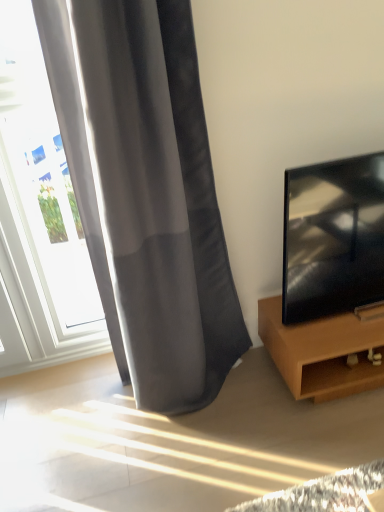
Where is `black glossy tv at right`? This screenshot has height=512, width=384. black glossy tv at right is located at coordinates (333, 238).

From the picture: Measure the distance between black glossy tv at right and camera.

1.43 meters.

What do you see at coordinates (322, 352) in the screenshot?
I see `brown wood tv stand at right` at bounding box center [322, 352].

Identify the location of white glass window at left. The height and width of the screenshot is (512, 384). (42, 188).

Who is more distant, brown wood tv stand at right or black glossy tv at right?

brown wood tv stand at right is behind.

Based on the photo, would you say brown wood tv stand at right is outside black glossy tv at right?

brown wood tv stand at right is positioned outside black glossy tv at right.

From the image's perspective, between brown wood tv stand at right and black glossy tv at right, which one is located above?

black glossy tv at right.

Is brown wood tv stand at right shorter than black glossy tv at right?

Indeed, brown wood tv stand at right has a lesser height compared to black glossy tv at right.

Which is farther, [178,220] or [50,253]?

The point [50,253] is farther.

What's the angular difference between satin gray curtain at left and white glass window at left's facing directions?

They differ by 0.0061 degrees in their facing directions.

Considering the relative sizes of satin gray curtain at left and white glass window at left in the image provided, is satin gray curtain at left shorter than white glass window at left?

In fact, satin gray curtain at left may be taller than white glass window at left.

In the scene shown: Are satin gray curtain at left and white glass window at left making contact?

No, satin gray curtain at left is not making contact with white glass window at left.

What's the angular difference between white glass window at left and brown wood tv stand at right's facing directions?

0.00624 degrees separate the facing orientations of white glass window at left and brown wood tv stand at right.

Is white glass window at left facing away from brown wood tv stand at right?

white glass window at left does not have its back to brown wood tv stand at right.

Can you confirm if white glass window at left is shorter than brown wood tv stand at right?

In fact, white glass window at left may be taller than brown wood tv stand at right.

From a real-world perspective, between white glass window at left and brown wood tv stand at right, who is vertically lower?

From a 3D spatial view, brown wood tv stand at right is below.

Is white glass window at left bigger or smaller than black glossy tv at right?

Considering their sizes, white glass window at left takes up less space than black glossy tv at right.

Does point (62, 302) come closer to viewer compared to point (295, 305)?

No.

Consider the image. Is the surface of white glass window at left in direct contact with black glossy tv at right?

They are not placed beside each other.

From the image's perspective, which object appears higher, white glass window at left or black glossy tv at right?

white glass window at left appears higher in the image.

Is brown wood tv stand at right further to camera compared to satin gray curtain at left?

Yes, brown wood tv stand at right is further from the camera.

Is satin gray curtain at left inside brown wood tv stand at right?

No, satin gray curtain at left is located outside of brown wood tv stand at right.

Which point is more distant from viewer, (270, 315) or (170, 305)?

The point (270, 315) is farther.

Looking at this image, is the position of white glass window at left more distant than that of satin gray curtain at left?

Yes, it is.

How distant is white glass window at left from satin gray curtain at left?

A distance of 17.96 inches exists between white glass window at left and satin gray curtain at left.

From a real-world perspective, is white glass window at left positioned above or below satin gray curtain at left?

white glass window at left is situated lower than satin gray curtain at left in the real world.

Would you say black glossy tv at right is a long distance from brown wood tv stand at right?

That's not correct — black glossy tv at right is a little close to brown wood tv stand at right.

Visually, is black glossy tv at right positioned to the left or to the right of brown wood tv stand at right?

From the image, it's evident that black glossy tv at right is to the left of brown wood tv stand at right.

Can you confirm if black glossy tv at right is taller than brown wood tv stand at right?

Yes.

From a real-world perspective, relative to brown wood tv stand at right, is black glossy tv at right vertically above or below?

black glossy tv at right is above brown wood tv stand at right.

Identify the location of furniture below the black glossy tv at right (from a real-world perspective). Image resolution: width=384 pixels, height=512 pixels. (322, 352).

You are a GUI agent. You are given a task and a screenshot of the screen. Output one action in this format:
    pyautogui.click(x=<x>, y=<y>)
    Task: Click on the curtain in front of the white glass window at left
    This screenshot has width=384, height=512.
    Given the screenshot: What is the action you would take?
    pyautogui.click(x=154, y=200)

Looking at this image, looking at the image, which one is located further to white glass window at left, brown wood tv stand at right or satin gray curtain at left?

Among the two, brown wood tv stand at right is located further to white glass window at left.

When comparing their distances from black glossy tv at right, does satin gray curtain at left or white glass window at left seem further?

white glass window at left is positioned further to the anchor black glossy tv at right.

Considering their positions, is brown wood tv stand at right positioned closer to satin gray curtain at left than black glossy tv at right?

black glossy tv at right lies closer to satin gray curtain at left than the other object.

Estimate the real-world distances between objects in this image. Which object is closer to black glossy tv at right, white glass window at left or brown wood tv stand at right?

brown wood tv stand at right.

From the image, which object appears to be nearer to black glossy tv at right, satin gray curtain at left or brown wood tv stand at right?

brown wood tv stand at right is positioned closer to the anchor black glossy tv at right.

When comparing their distances from white glass window at left, does black glossy tv at right or brown wood tv stand at right seem closer?

Among the two, black glossy tv at right is located nearer to white glass window at left.

Considering their positions, is satin gray curtain at left positioned further to brown wood tv stand at right than black glossy tv at right?

Among the two, satin gray curtain at left is located further to brown wood tv stand at right.

From the picture: When comparing their distances from black glossy tv at right, does brown wood tv stand at right or white glass window at left seem further?

white glass window at left.

You are a GUI agent. You are given a task and a screenshot of the screen. Output one action in this format:
    pyautogui.click(x=<x>, y=<y>)
    Task: Click on the television between white glass window at left and brown wood tv stand at right from left to right
    The width and height of the screenshot is (384, 512).
    Given the screenshot: What is the action you would take?
    pyautogui.click(x=333, y=238)

What are the coordinates of `television situated between satin gray curtain at left and brown wood tv stand at right from left to right` in the screenshot? It's located at (333, 238).

What are the coordinates of `curtain situated between white glass window at left and brown wood tv stand at right from left to right` in the screenshot? It's located at (154, 200).

Where is `curtain situated between white glass window at left and black glossy tv at right from left to right`? The height and width of the screenshot is (512, 384). curtain situated between white glass window at left and black glossy tv at right from left to right is located at coordinates (154, 200).